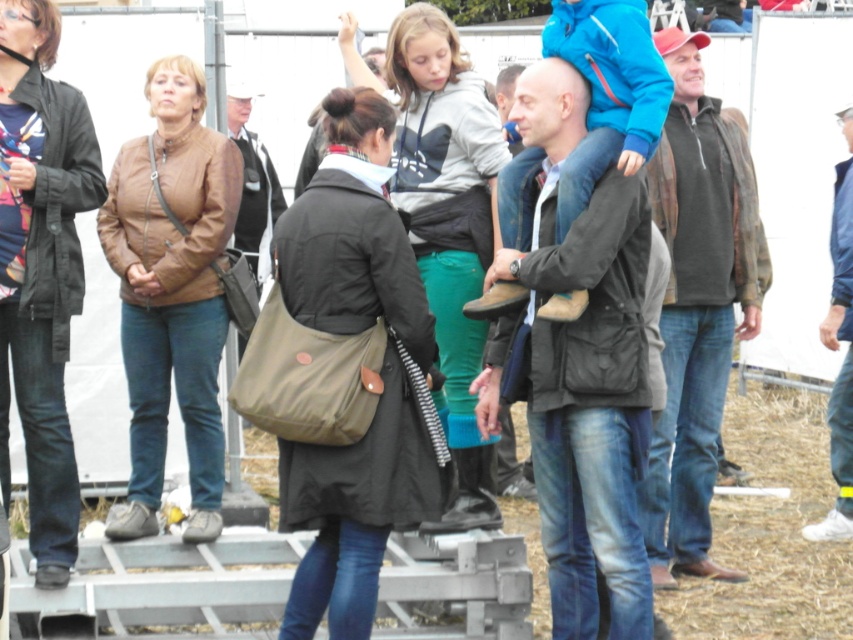
Question: Which of the following is the farthest from the observer?

Choices:
 (A) olive green fabric bag at center
 (B) brown leather jacket at left
 (C) brown leather jacket at center
 (D) blue fabric jacket at upper right

Answer: (D)

Question: Which point is closer to the camera?

Choices:
 (A) (350, 244)
 (B) (213, 184)

Answer: (A)

Question: Is brown leather jacket at center to the left of gray hoodie at center from the viewer's perspective?

Choices:
 (A) no
 (B) yes

Answer: (A)

Question: In this image, where is brown leather jacket at left located relative to gray hoodie at center?

Choices:
 (A) left
 (B) right

Answer: (A)

Question: Does brown leather jacket at left have a greater width compared to matte black jacket at lower left?

Choices:
 (A) yes
 (B) no

Answer: (A)

Question: Which point is closer to the camera taking this photo?

Choices:
 (A) (514, 346)
 (B) (482, 236)
 (C) (403, 310)

Answer: (C)